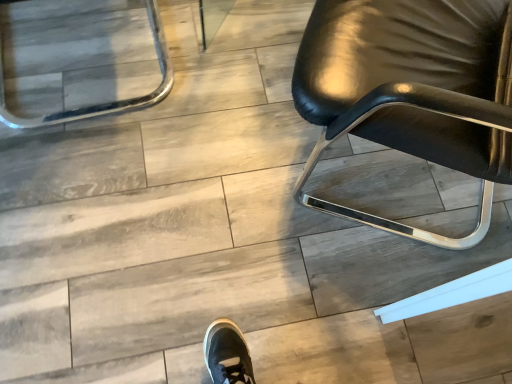
Question: Considering the positions of clear glass tray at upper left, placed as the 2th chair when sorted from right to left, and glossy black chair at right, which is counted as the first chair, starting from the right, in the image, is clear glass tray at upper left, placed as the 2th chair when sorted from right to left, taller or shorter than glossy black chair at right, which is counted as the first chair, starting from the right,?

Choices:
 (A) short
 (B) tall

Answer: (A)

Question: Is clear glass tray at upper left, placed as the 2th chair when sorted from right to left, to the left or to the right of glossy black chair at right, the 2th chair in the left-to-right sequence, in the image?

Choices:
 (A) left
 (B) right

Answer: (A)

Question: Looking at the image, does clear glass tray at upper left, placed as the 2th chair when sorted from right to left, seem bigger or smaller compared to glossy black chair at right, the 2th chair in the left-to-right sequence?

Choices:
 (A) small
 (B) big

Answer: (A)

Question: Considering the positions of point (328, 79) and point (159, 18), is point (328, 79) closer or farther from the camera than point (159, 18)?

Choices:
 (A) closer
 (B) farther

Answer: (A)

Question: From a real-world perspective, is glossy black chair at right, which is counted as the first chair, starting from the right, physically located above or below clear glass tray at upper left, placed as the 2th chair when sorted from right to left?

Choices:
 (A) below
 (B) above

Answer: (B)

Question: In terms of width, does glossy black chair at right, which is counted as the first chair, starting from the right, look wider or thinner when compared to clear glass tray at upper left, which is the first chair from left to right?

Choices:
 (A) wide
 (B) thin

Answer: (A)

Question: Do you think glossy black chair at right, the 2th chair in the left-to-right sequence, is within clear glass tray at upper left, placed as the 2th chair when sorted from right to left, or outside of it?

Choices:
 (A) inside
 (B) outside

Answer: (B)